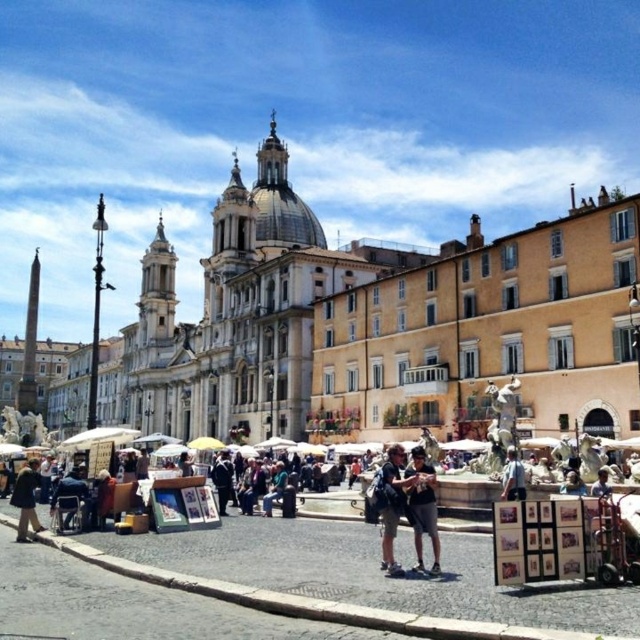
Is dark blue jeans at center bigger than brown fur coat at lower left?

No, dark blue jeans at center is not bigger than brown fur coat at lower left.

Is dark blue jeans at center below brown fur coat at lower left?

Incorrect, dark blue jeans at center is not positioned below brown fur coat at lower left.

Between point (433, 492) and point (42, 529), which one is positioned behind?

The point (42, 529) is behind.

Identify the location of dark blue jeans at center. (422, 506).

Who is positioned more to the left, denim shorts at center or brown fur coat at lower left?

brown fur coat at lower left

Is point (392, 552) more distant than point (22, 472)?

No, (392, 552) is in front of (22, 472).

In order to click on denim shorts at center in this screenshot , I will do `click(392, 504)`.

Does dark blue jeans at center have a lesser height compared to denim shorts at center?

Indeed, dark blue jeans at center has a lesser height compared to denim shorts at center.

Consider the image. Between dark blue jeans at center and denim shorts at center, which one appears on the left side from the viewer's perspective?

Positioned to the left is denim shorts at center.

Between point (436, 547) and point (390, 465), which one is positioned in front?

Point (436, 547) is in front.

Where is `dark blue jeans at center`? The width and height of the screenshot is (640, 640). dark blue jeans at center is located at coordinates (422, 506).